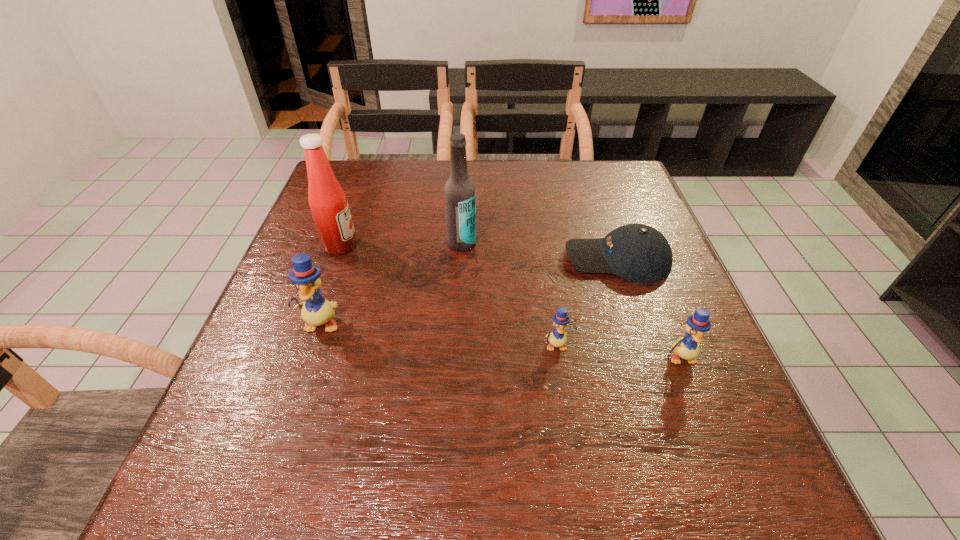
Please point a location where one more duckling can be added evenly. Please provide its 2D coordinates. Your answer should be formatted as a tuple, i.e. [(x, y)], where the tuple contains the x and y coordinates of a point satisfying the conditions above.

[(436, 334)]